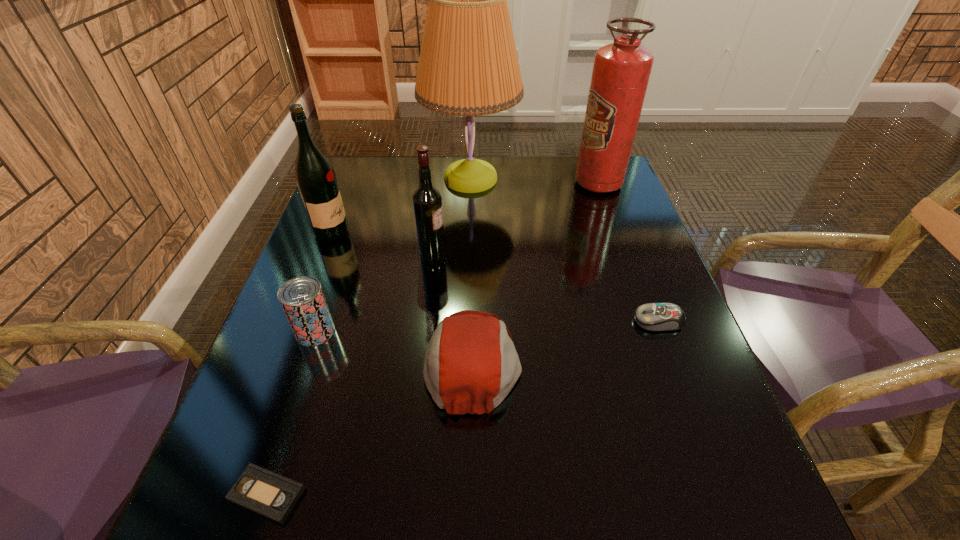
You are a GUI agent. You are given a task and a screenshot of the screen. Output one action in this format:
    pyautogui.click(x=<x>, y=<y>)
    Task: Click on the vacant region located 0.340m on the wheel side of the second shortest object
    
    Given the screenshot: What is the action you would take?
    pyautogui.click(x=472, y=321)

You are a GUI agent. You are given a task and a screenshot of the screen. Output one action in this format:
    pyautogui.click(x=<x>, y=<y>)
    Task: Click on the vacant region located 0.220m on the back of the videotape
    This screenshot has width=960, height=540.
    Given the screenshot: What is the action you would take?
    pyautogui.click(x=314, y=354)

This screenshot has height=540, width=960. I want to click on lamp at the far edge, so click(x=468, y=66).

The width and height of the screenshot is (960, 540). What are the coordinates of `fire extinguisher situated at the far edge` in the screenshot? It's located at (621, 70).

Locate an element on the screen. object that is positioned at the near edge is located at coordinates (273, 496).

Locate an element on the screen. liquor located at the left edge is located at coordinates (316, 180).

Identify the location of beer can situated at the left edge. This screenshot has height=540, width=960. (302, 299).

Locate an element on the screen. Image resolution: width=960 pixels, height=540 pixels. videotape that is positioned at the left edge is located at coordinates (273, 496).

At what (x,y) coordinates should I click in order to perform the action: click on fire extinguisher located in the right edge section of the desktop. Please return your answer as a coordinate pair (x, y). The width and height of the screenshot is (960, 540). Looking at the image, I should click on click(x=621, y=70).

The width and height of the screenshot is (960, 540). I want to click on computer mouse located in the right edge section of the desktop, so click(x=657, y=317).